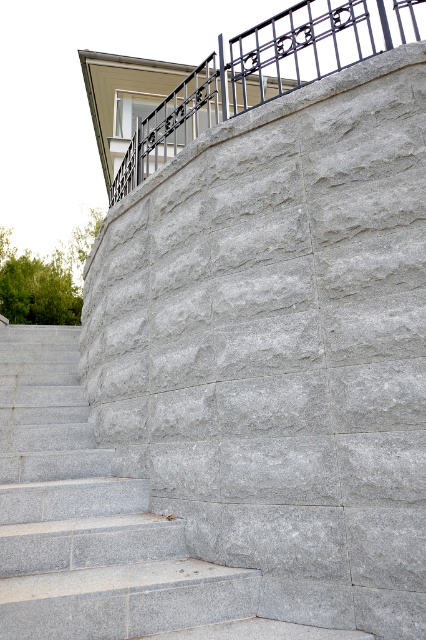
Based on the photo, can you confirm if gray stone stairs at center is smaller than black wrought iron railing at upper center?

Yes.

Based on the photo, does gray stone stairs at center have a greater height compared to black wrought iron railing at upper center?

No, gray stone stairs at center is not taller than black wrought iron railing at upper center.

Which is in front, point (54, 600) or point (236, 81)?

Point (54, 600) is more forward.

The height and width of the screenshot is (640, 426). What are the coordinates of `gray stone stairs at center` in the screenshot? It's located at (88, 518).